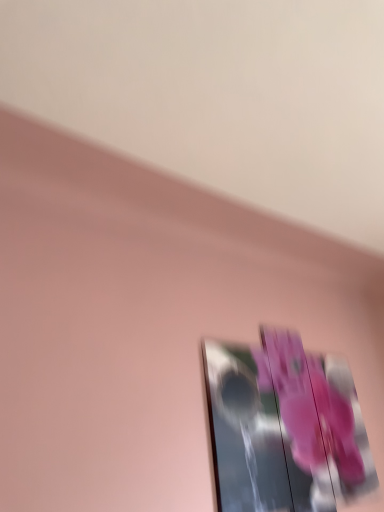
Measure the distance between metallic silver picture frame at upper center and camera.

1.39 meters.

The image size is (384, 512). What do you see at coordinates (283, 428) in the screenshot? I see `metallic silver picture frame at upper center` at bounding box center [283, 428].

The height and width of the screenshot is (512, 384). I want to click on metallic silver picture frame at upper center, so click(x=283, y=428).

You are a GUI agent. You are given a task and a screenshot of the screen. Output one action in this format:
    pyautogui.click(x=<x>, y=<y>)
    Task: Click on the metallic silver picture frame at upper center
    Image resolution: width=384 pixels, height=512 pixels.
    Given the screenshot: What is the action you would take?
    pyautogui.click(x=283, y=428)